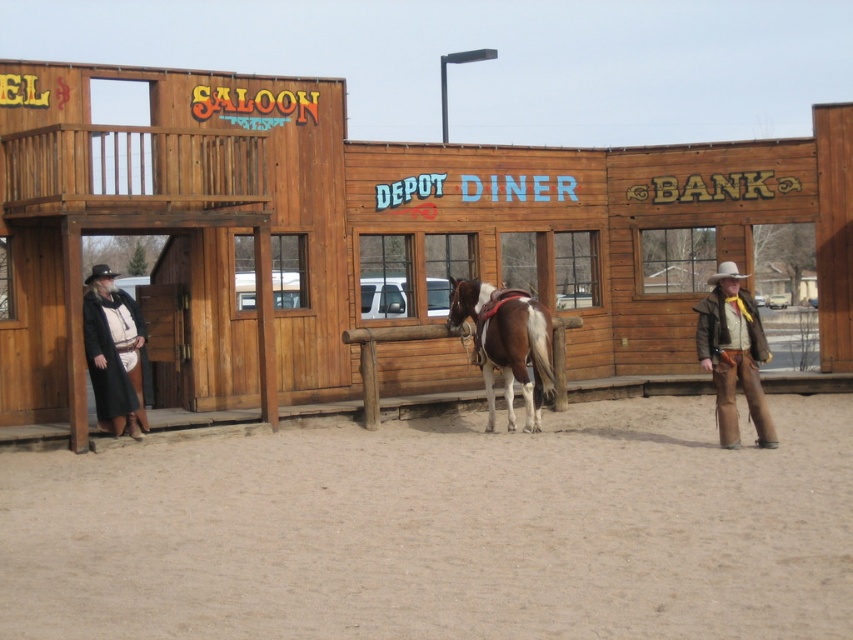
Between leather jacket at left and brown leather cowboy hat at center, which one has less height?

Result: Standing shorter between the two is brown leather cowboy hat at center.

Is leather jacket at left further to the viewer compared to brown leather cowboy hat at center?

That is True.

Between point (114, 369) and point (729, 262), which one is positioned in front?

Point (729, 262)

At what (x,y) coordinates should I click in order to perform the action: click on leather jacket at left. Please return your answer as a coordinate pair (x, y). The width and height of the screenshot is (853, 640). Looking at the image, I should click on (113, 353).

How far apart are brown glossy horse at center and brown leather jacket at right?

brown glossy horse at center and brown leather jacket at right are 2.41 meters apart.

Does brown glossy horse at center appear on the left side of brown leather jacket at right?

Yes, brown glossy horse at center is to the left of brown leather jacket at right.

Between point (514, 291) and point (706, 365), which one is positioned behind?

Point (514, 291)

The width and height of the screenshot is (853, 640). I want to click on brown glossy horse at center, so click(506, 342).

Who is more distant from viewer, [758,348] or [86,298]?

Point [86,298]

Is brown leather jacket at right positioned in front of leather jacket at left?

Yes, it is.

Between point (750, 305) and point (132, 348), which one is positioned behind?

Point (132, 348)

The image size is (853, 640). Identify the location of brown leather jacket at right. (733, 355).